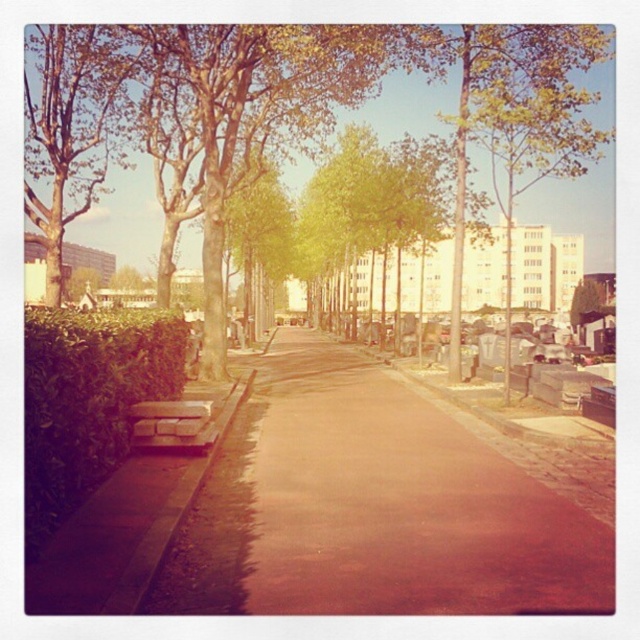
You are a gardener planning to trim the trees in the urban scene. You see the green leafy tree at upper left and the green leafy tree at upper center. Which tree should you prioritize if you need to trim the taller one first?

The green leafy tree at upper center should be prioritized for trimming first because it is taller than the green leafy tree at upper left according to the description.

You are a maintenance worker who needs to water the green leafy hedge at lower left and the wooden park bench at lower left. You have a water hose that is 40 inches long. Can you water both objects without moving the hose nozzle?

The green leafy hedge at lower left is 38.50 inches away from the wooden park bench at lower left. Since the hose is 40 inches long, which is longer than the distance between them, you can water both objects without moving the hose nozzle.